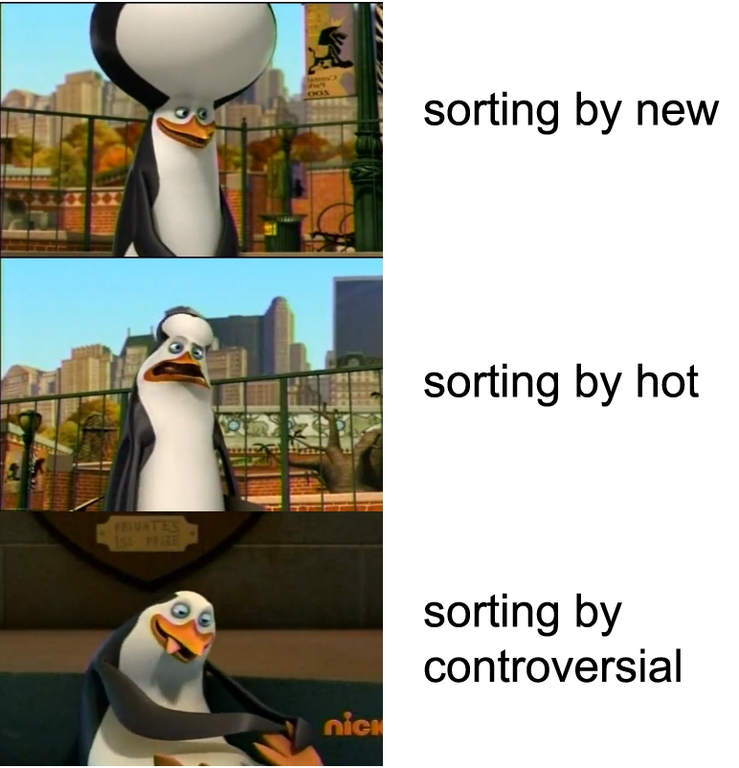
Where is `handrails`? This screenshot has height=768, width=739. handrails is located at coordinates (100, 117), (285, 379).